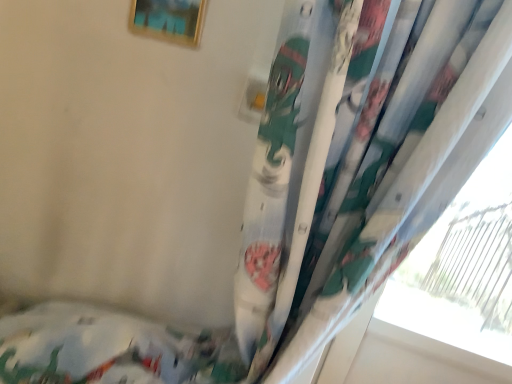
Question: Considering the positions of gold metallic picture frame at upper center and white cotton bed at lower left in the image, is gold metallic picture frame at upper center bigger or smaller than white cotton bed at lower left?

Choices:
 (A) big
 (B) small

Answer: (B)

Question: Is gold metallic picture frame at upper center to the left or to the right of white cotton bed at lower left in the image?

Choices:
 (A) right
 (B) left

Answer: (A)

Question: From the image's perspective, is gold metallic picture frame at upper center located above or below white cotton bed at lower left?

Choices:
 (A) below
 (B) above

Answer: (B)

Question: Is white cotton bed at lower left situated inside gold metallic picture frame at upper center or outside?

Choices:
 (A) outside
 (B) inside

Answer: (A)

Question: Considering their positions, is white cotton bed at lower left located in front of or behind gold metallic picture frame at upper center?

Choices:
 (A) behind
 (B) front

Answer: (A)

Question: Is white cotton bed at lower left to the left or to the right of gold metallic picture frame at upper center in the image?

Choices:
 (A) right
 (B) left

Answer: (B)

Question: From the image's perspective, is white cotton bed at lower left located above or below gold metallic picture frame at upper center?

Choices:
 (A) below
 (B) above

Answer: (A)